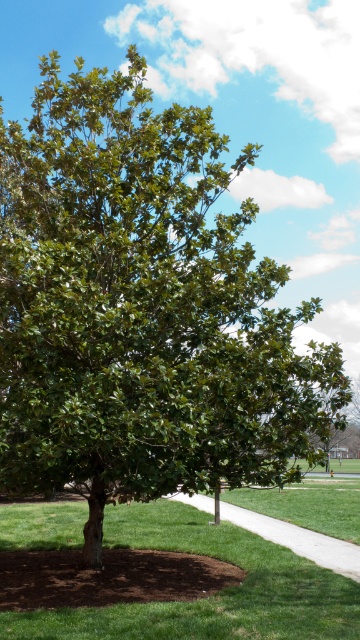
Measure the distance from green grass at center to white concrete sidewalk at lower center.

The distance of green grass at center from white concrete sidewalk at lower center is 1.56 meters.

Does green grass at center have a lesser width compared to white concrete sidewalk at lower center?

In fact, green grass at center might be wider than white concrete sidewalk at lower center.

What do you see at coordinates (209, 596) in the screenshot? I see `green grass at center` at bounding box center [209, 596].

Where is `green grass at center`? green grass at center is located at coordinates (209, 596).